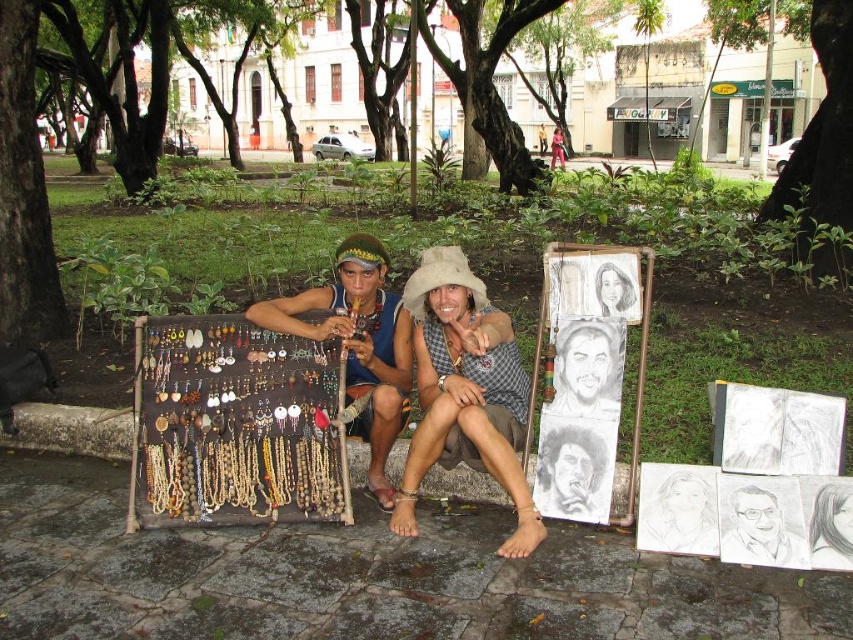
You are a customer at an outdoor market and see two sets of wooden beads displayed on stands. The wooden beads at center and the wooden beads at left are both available. Which set has beads with a larger diameter?

The wooden beads at center has a larger width than the wooden beads at left, so the set at center has beads with a larger diameter.

You are a customer looking at the jewelry stand. You see wooden beads at center and wooden beads at left. Which one is positioned more to the right?

The wooden beads at center is positioned more to the right than the wooden beads at left.